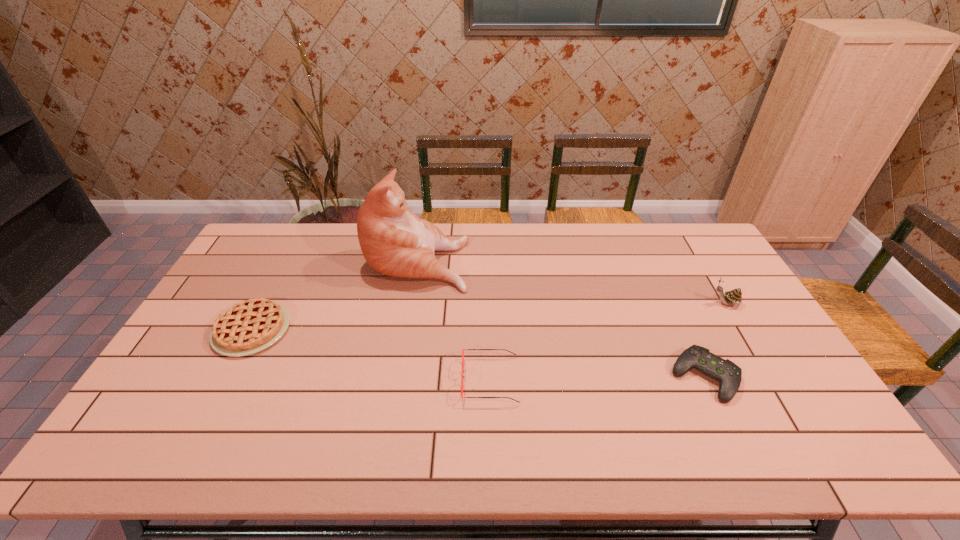
At what (x,y) coordinates should I click in order to perform the action: click on the farthest object. Please return your answer as a coordinate pair (x, y). Looking at the image, I should click on (x=394, y=241).

Image resolution: width=960 pixels, height=540 pixels. What are the coordinates of `the tallest object` in the screenshot? It's located at (394, 241).

I want to click on the second tallest object, so (734, 297).

Identify the location of the rightmost object. (734, 297).

You are a GUI agent. You are given a task and a screenshot of the screen. Output one action in this format:
    pyautogui.click(x=<x>, y=<y>)
    Task: Click on the third tallest object
    
    Given the screenshot: What is the action you would take?
    pyautogui.click(x=462, y=376)

Image resolution: width=960 pixels, height=540 pixels. I want to click on the leftmost object, so click(x=250, y=326).

Locate an element on the screen. Image resolution: width=960 pixels, height=540 pixels. the fourth object from left to right is located at coordinates (729, 375).

In order to click on free spot located 0.270m on the face of the tallest object in this screenshot , I will do `click(545, 259)`.

Locate an element on the screen. The image size is (960, 540). vacant space situated on the face of the snail is located at coordinates (595, 303).

What are the coordinates of `vacant space positioned on the face of the snail` in the screenshot? It's located at pyautogui.click(x=588, y=303).